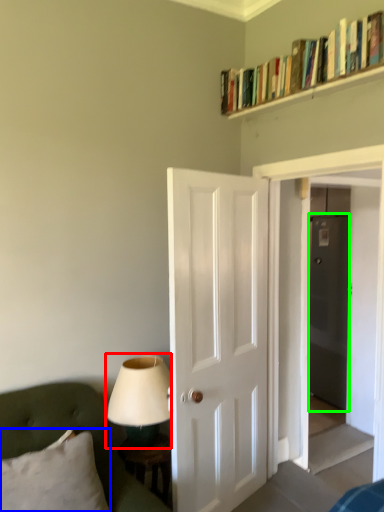
Question: Which object is positioned farthest from table lamp (highlighted by a red box)? Select from pillow (highlighted by a blue box) and glass door (highlighted by a green box).

Choices:
 (A) pillow
 (B) glass door

Answer: (B)